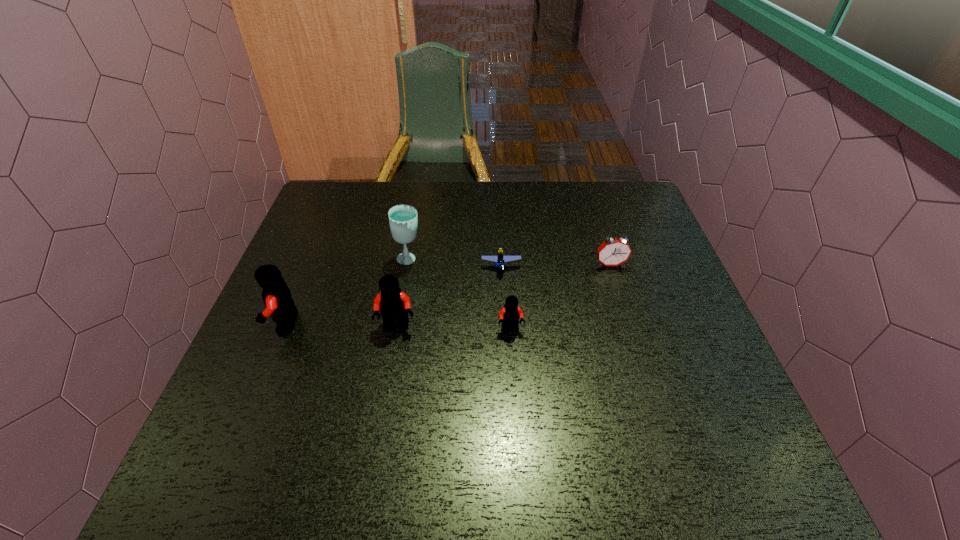
This screenshot has width=960, height=540. I want to click on free space between the glass and the alarm clock, so click(510, 262).

At what (x,y) coordinates should I click in order to perform the action: click on vacant region between the second Lego from left to right and the rightmost object. Please return your answer as a coordinate pair (x, y). The height and width of the screenshot is (540, 960). Looking at the image, I should click on (504, 295).

Identify the location of free spot between the rightmost object and the leftmost object. The width and height of the screenshot is (960, 540). (447, 294).

This screenshot has height=540, width=960. What are the coordinates of `unoccupied area between the glass and the shortest object` in the screenshot? It's located at (455, 263).

Where is `free space between the third tallest Lego and the rightmost object`? free space between the third tallest Lego and the rightmost object is located at coordinates (561, 297).

The image size is (960, 540). What are the coordinates of `free space that is in between the glass and the leftmost Lego` in the screenshot? It's located at (347, 291).

Where is `empty location between the glass and the second shortest Lego`? The height and width of the screenshot is (540, 960). empty location between the glass and the second shortest Lego is located at coordinates click(460, 294).

The image size is (960, 540). In order to click on object that is the second closest to the third Lego from right to left in this screenshot , I will do `click(276, 295)`.

Locate an element on the screen. This screenshot has width=960, height=540. object that is the third closest to the farthest Lego is located at coordinates (613, 251).

Locate an element on the screen. The width and height of the screenshot is (960, 540). Lego that is the second closest to the second shortest Lego is located at coordinates (394, 305).